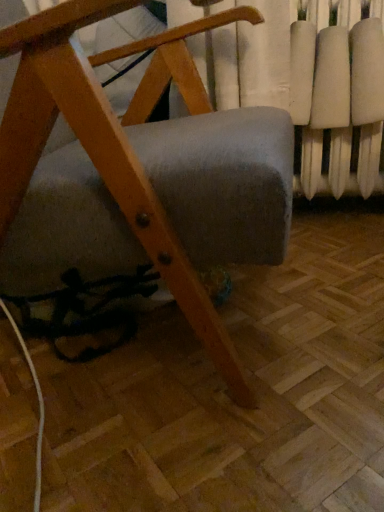
The image size is (384, 512). Describe the element at coordinates (136, 172) in the screenshot. I see `wooden chair at center` at that location.

What is the approximate width of wooden chair at center?

29.66 inches.

From the picture: In order to face wooden chair at center, should I rotate leftwards or rightwards?

Answer: To face it directly, rotate left by 12.143 degrees.

This screenshot has height=512, width=384. I want to click on wooden chair at center, so point(136,172).

Identify the location of wooden chair at center. [x=136, y=172].